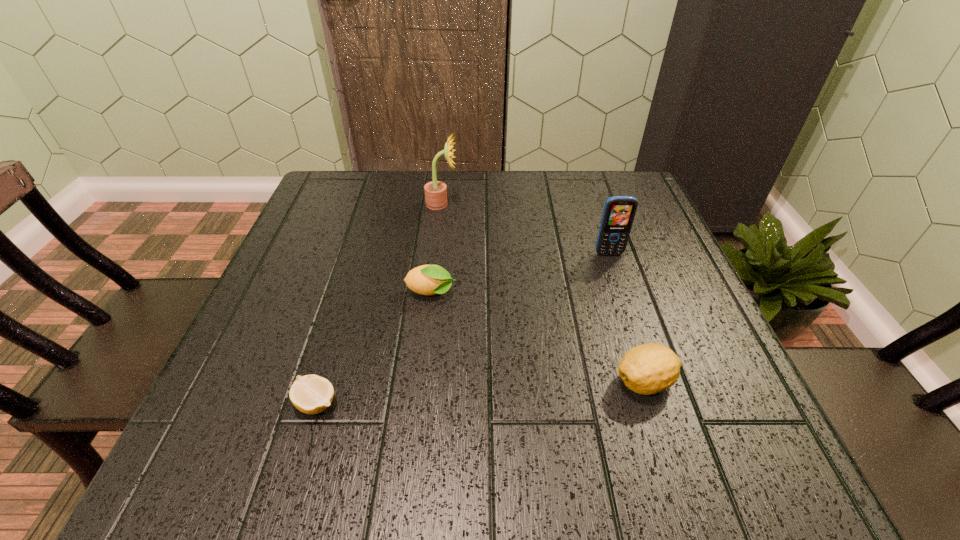
Find the location of a particular element. This screenshot has width=960, height=540. the farthest object is located at coordinates (436, 191).

This screenshot has width=960, height=540. What are the coordinates of `sunflower` in the screenshot? It's located at (436, 191).

This screenshot has height=540, width=960. I want to click on the second farthest object, so click(x=619, y=212).

The image size is (960, 540). I want to click on the second tallest object, so click(619, 212).

Locate an element on the screen. Image resolution: width=960 pixels, height=540 pixels. the rightmost lemon is located at coordinates (647, 369).

The height and width of the screenshot is (540, 960). I want to click on the third farthest object, so click(x=428, y=280).

Locate an element on the screen. The image size is (960, 540). the second lemon from right to left is located at coordinates (428, 280).

Identify the location of the shortest lemon. (311, 394).

This screenshot has height=540, width=960. I want to click on the shortest object, so click(x=311, y=394).

The height and width of the screenshot is (540, 960). Identify the location of free space located on the face of the tallest object. (546, 204).